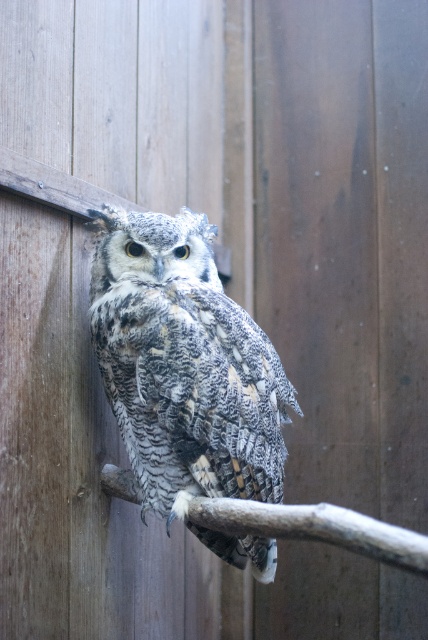
Does speckled feathered owl at center have a greater width compared to smooth brown branch at center?

Incorrect, speckled feathered owl at center's width does not surpass smooth brown branch at center's.

Is speckled feathered owl at center thinner than smooth brown branch at center?

Correct, speckled feathered owl at center's width is less than smooth brown branch at center's.

Between point (265, 410) and point (267, 534), which one is positioned behind?

Positioned behind is point (265, 410).

Where is `speckled feathered owl at center`? This screenshot has width=428, height=640. speckled feathered owl at center is located at coordinates (184, 365).